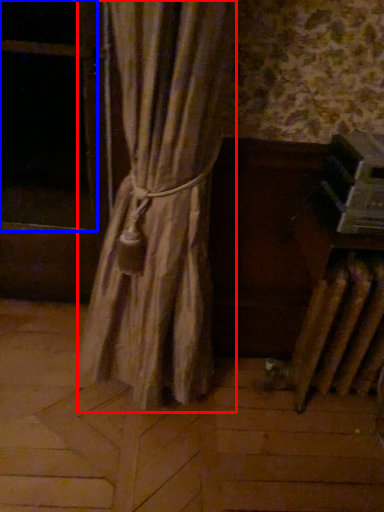
Question: Which point is further to the camera, curtain (highlighted by a red box) or window screen (highlighted by a blue box)?

Choices:
 (A) curtain
 (B) window screen

Answer: (B)